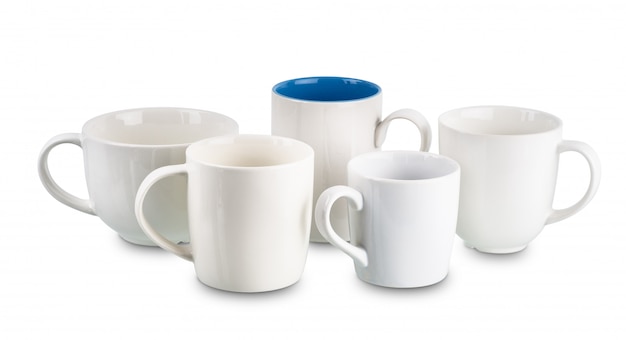
Point to any where handle connects to mug in the image. Your answer should be formatted as a list of tuples, i.e. [(x1, y1), (x2, y2), ...], where each tuple contains the x and y coordinates of a point satisfying the conditions above.

[(192, 258), (183, 168), (93, 212), (80, 138), (365, 262), (359, 203), (376, 134), (560, 147), (548, 216)]